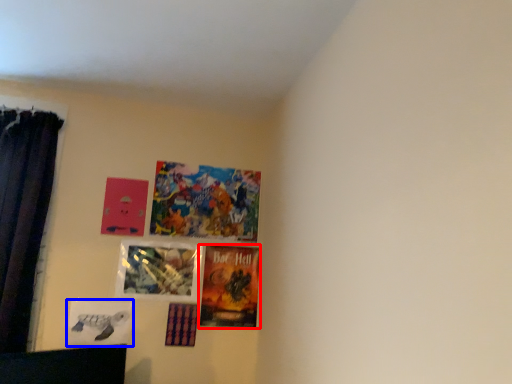
Question: Which object appears closest to the camera in this image, picture frame (highlighted by a red box) or picture frame (highlighted by a blue box)?

Choices:
 (A) picture frame
 (B) picture frame

Answer: (B)